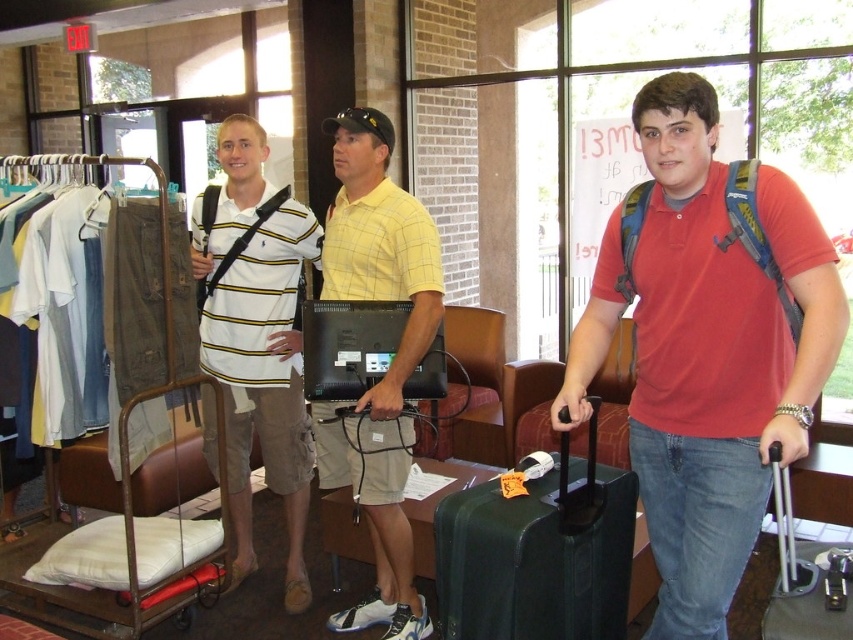
You are standing in the scene and need to retrieve your black hard suitcase at center. However, there is another black hard suitcase at lower right blocking it. Can you reach your suitcase without moving the one on top?

The black hard suitcase at lower right is positioned over the black hard suitcase at center, so you cannot reach your suitcase without moving the one on top.

You are a delivery person who needs to place a package between the yellow plaid shirt at center and the black hard suitcase at center. Can you fit the package if it requires 1.2 meters of space?

The distance between the yellow plaid shirt at center and the black hard suitcase at center is 1.34 meters, which is more than enough to fit a package requiring 1.2 meters of space.